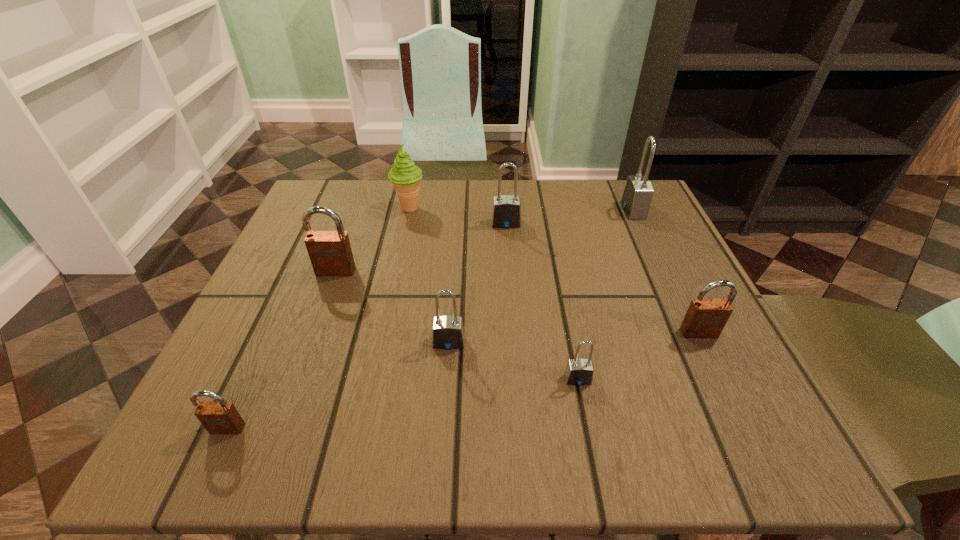
Where is `the second nearest brown padlock`? the second nearest brown padlock is located at coordinates (705, 318).

Identify the location of the second biggest brown padlock. The width and height of the screenshot is (960, 540). (705, 318).

Identify the location of the third object from right to left. (578, 372).

The height and width of the screenshot is (540, 960). Identify the location of the second nearest object. (578, 372).

Identify the location of the nearest padlock. This screenshot has width=960, height=540. (221, 417).

Locate an element on the screen. This screenshot has height=540, width=960. the leftmost object is located at coordinates (221, 417).

Image resolution: width=960 pixels, height=540 pixels. Find the location of `free space located on the shackle of the biggest gray padlock`. free space located on the shackle of the biggest gray padlock is located at coordinates (597, 210).

The image size is (960, 540). Identify the location of vacant space located 0.390m on the shackle of the biggest gray padlock. (457, 210).

Where is `vacant space located 0.140m on the shackle of the biggest gray padlock`? vacant space located 0.140m on the shackle of the biggest gray padlock is located at coordinates tap(564, 210).

Locate an element on the screen. vacant region located 0.290m on the right of the green icecream is located at coordinates (549, 208).